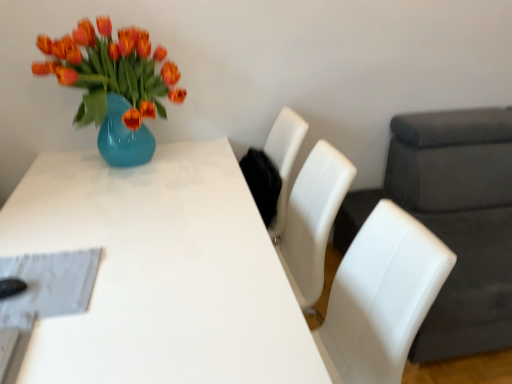
The height and width of the screenshot is (384, 512). What do you see at coordinates (453, 221) in the screenshot?
I see `white leather swivel chair at right` at bounding box center [453, 221].

Locate an element on the screen. white leather swivel chair at right is located at coordinates (453, 221).

What is the approximate width of white leather swivel chair at right?

1.14 meters.

What is the approximate height of white leather swivel chair at right?

88.74 centimeters.

What do you see at coordinates (160, 273) in the screenshot? The image size is (512, 384). I see `white glossy table at center` at bounding box center [160, 273].

Find the location of a particular element. white glossy table at center is located at coordinates (160, 273).

Where is `white leather swivel chair at right`? The width and height of the screenshot is (512, 384). white leather swivel chair at right is located at coordinates (453, 221).

Is white leather swivel chair at right to the right of white glossy table at center from the viewer's perspective?

Correct, you'll find white leather swivel chair at right to the right of white glossy table at center.

Is white leather swivel chair at right further to the viewer compared to white glossy table at center?

That is True.

Which is in front, point (413, 361) or point (283, 277)?

The point (283, 277) is closer to the camera.

From the image's perspective, which one is positioned lower, white leather swivel chair at right or white glossy table at center?

white glossy table at center appears lower in the image.

From a real-world perspective, is white leather swivel chair at right physically below white glossy table at center?

Actually, white leather swivel chair at right is physically above white glossy table at center in the real world.

Is white leather swivel chair at right wider or thinner than white glossy table at center?

Clearly, white leather swivel chair at right has less width compared to white glossy table at center.

Does white leather swivel chair at right have a greater height compared to white glossy table at center?

Correct, white leather swivel chair at right is much taller as white glossy table at center.

Looking at the image, does white leather swivel chair at right seem bigger or smaller compared to white glossy table at center?

Clearly, white leather swivel chair at right is larger in size than white glossy table at center.

Is white leather swivel chair at right situated inside white glossy table at center or outside?

white leather swivel chair at right is not enclosed by white glossy table at center.

From the picture: Is white leather swivel chair at right touching white glossy table at center?

They are not placed beside each other.

Is white leather swivel chair at right facing towards white glossy table at center?

Yes, white leather swivel chair at right is oriented towards white glossy table at center.

What's the angular difference between white leather swivel chair at right and white glossy table at center's facing directions?

The facing directions of white leather swivel chair at right and white glossy table at center are 90.1 degrees apart.

The width and height of the screenshot is (512, 384). What are the coordinates of `table below the white leather swivel chair at right (from a real-world perspective)` in the screenshot? It's located at (160, 273).

Considering the relative positions of white glossy table at center and white leather swivel chair at right in the image provided, is white glossy table at center to the right of white leather swivel chair at right from the viewer's perspective?

Incorrect, white glossy table at center is not on the right side of white leather swivel chair at right.

Between white glossy table at center and white leather swivel chair at right, which one is positioned in front?

white glossy table at center is in front.

Which point is more distant from viewer, (183, 162) or (478, 298)?

The point (183, 162) is farther.

From the image's perspective, between white glossy table at center and white leather swivel chair at right, which one is located above?

white leather swivel chair at right, from the image's perspective.

From a real-world perspective, between white glossy table at center and white leather swivel chair at right, who is vertically higher?

white leather swivel chair at right.

Considering the relative sizes of white glossy table at center and white leather swivel chair at right in the image provided, is white glossy table at center wider than white leather swivel chair at right?

Yes.

Considering the relative sizes of white glossy table at center and white leather swivel chair at right in the image provided, is white glossy table at center shorter than white leather swivel chair at right?

Indeed, white glossy table at center has a lesser height compared to white leather swivel chair at right.

Between white glossy table at center and white leather swivel chair at right, which one has larger size?

white leather swivel chair at right.

Is white glossy table at center completely or partially outside of white leather swivel chair at right?

Indeed, white glossy table at center is completely outside white leather swivel chair at right.

Is white glossy table at center placed right next to white leather swivel chair at right?

No, white glossy table at center is not next to white leather swivel chair at right.

Is white glossy table at center facing away from white leather swivel chair at right?

No, white leather swivel chair at right is not at the back of white glossy table at center.

How many degrees apart are the facing directions of white glossy table at center and white leather swivel chair at right?

The facing directions of white glossy table at center and white leather swivel chair at right are 90.1 degrees apart.

How much distance is there between white glossy table at center and white leather swivel chair at right?

The distance of white glossy table at center from white leather swivel chair at right is 3.38 feet.

Locate an element on the screen. Image resolution: width=512 pixels, height=384 pixels. table in front of the white leather swivel chair at right is located at coordinates (160, 273).

Where is `table directly beneath the white leather swivel chair at right (from a real-world perspective)`? table directly beneath the white leather swivel chair at right (from a real-world perspective) is located at coordinates (160, 273).

This screenshot has height=384, width=512. I want to click on table on the left of white leather swivel chair at right, so click(160, 273).